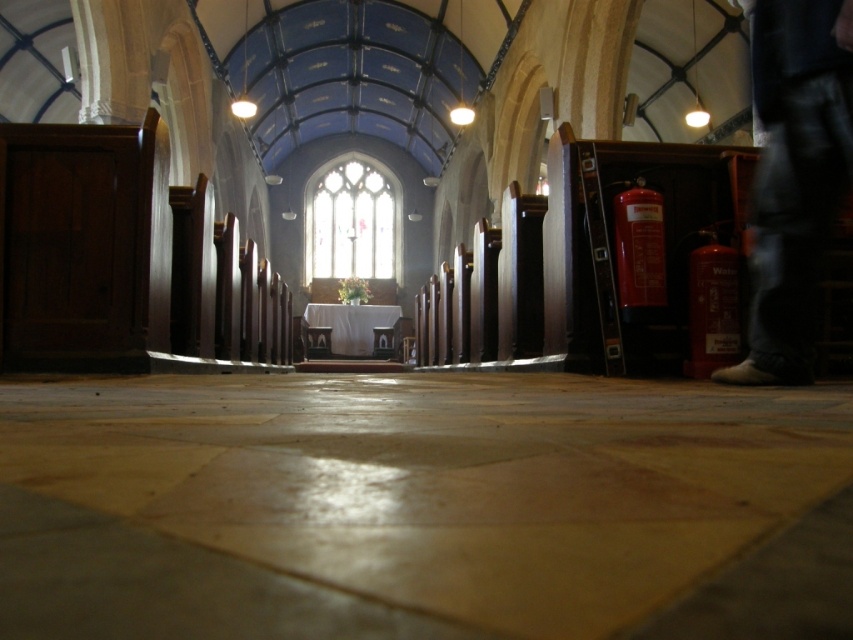
You are standing at the entrance of the church and looking towards the altar. There is a point marked at coordinates (x=390, y=500) in the image. Based on the scene description, what is the location of this point relative to the smooth stone aisle at center?

The point at coordinates (x=390, y=500) corresponds to the smooth stone aisle at center, as stated in the objects description.

You are standing in the church and want to walk towards the altar. Which object, the smooth stone aisle at center or the jeans at right, is closer to you as you begin your walk?

The smooth stone aisle at center is closer to the viewer than the jeans at right, so you would first encounter the smooth stone aisle at center as you begin walking towards the altar.